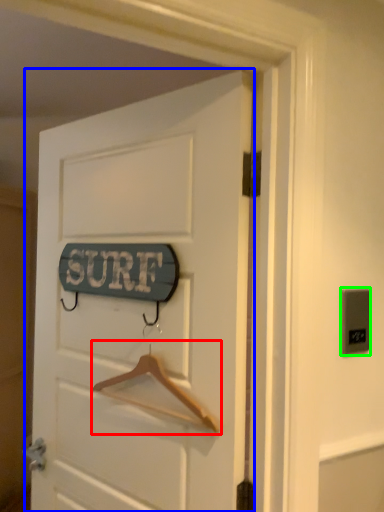
Question: Which is nearer to the hanger (highlighted by a red box)? door (highlighted by a blue box) or electric outlet (highlighted by a green box).

Choices:
 (A) door
 (B) electric outlet

Answer: (A)